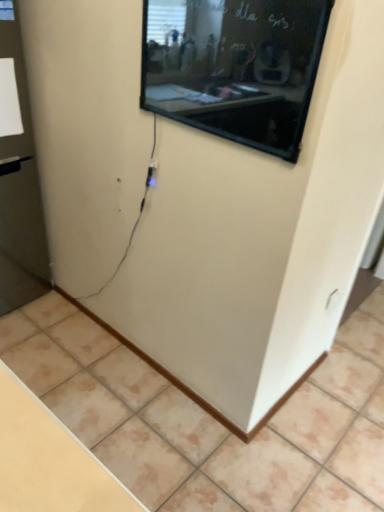
Question: Is point (3, 148) positioned closer to the camera than point (307, 23)?

Choices:
 (A) farther
 (B) closer

Answer: (A)

Question: Looking at the image, does transparent glass door at left seem bigger or smaller compared to black glossy screen at upper center?

Choices:
 (A) big
 (B) small

Answer: (A)

Question: Which object is positioned farthest from the beige tile at lower center?

Choices:
 (A) black glossy screen at upper center
 (B) transparent glass door at left

Answer: (A)

Question: Which is nearer to the beige tile at lower center?

Choices:
 (A) transparent glass door at left
 (B) black glossy screen at upper center

Answer: (A)